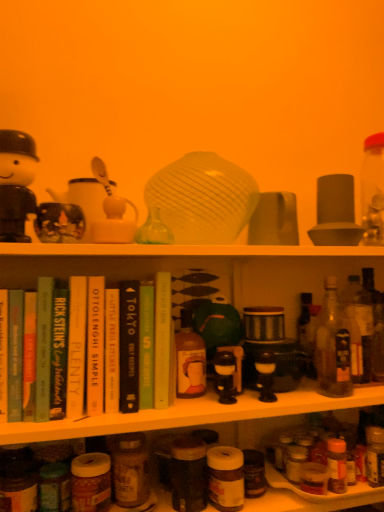
Question: Is matte brown bottle at lower center, marked as the first bottle in a left-to-right arrangement, not inside translucent glass bottle at right, which is counted as the third bottle, starting from the right?

Choices:
 (A) yes
 (B) no

Answer: (A)

Question: From a real-world perspective, is matte brown bottle at lower center, marked as the first bottle in a left-to-right arrangement, located higher than translucent glass bottle at right, which is counted as the third bottle, starting from the right?

Choices:
 (A) no
 (B) yes

Answer: (A)

Question: Does matte brown bottle at lower center, positioned as the 5th bottle in right-to-left order, have a larger size compared to translucent glass bottle at right, the third bottle in the left-to-right sequence?

Choices:
 (A) no
 (B) yes

Answer: (B)

Question: Considering the relative sizes of matte brown bottle at lower center, positioned as the 5th bottle in right-to-left order, and translucent glass bottle at right, the third bottle in the left-to-right sequence, in the image provided, is matte brown bottle at lower center, positioned as the 5th bottle in right-to-left order, taller than translucent glass bottle at right, the third bottle in the left-to-right sequence,?

Choices:
 (A) yes
 (B) no

Answer: (B)

Question: Considering the relative positions of matte brown bottle at lower center, positioned as the 5th bottle in right-to-left order, and translucent glass bottle at right, which is counted as the third bottle, starting from the right, in the image provided, is matte brown bottle at lower center, positioned as the 5th bottle in right-to-left order, behind translucent glass bottle at right, which is counted as the third bottle, starting from the right,?

Choices:
 (A) yes
 (B) no

Answer: (B)

Question: Considering the positions of green matte teapot at center, placed as the 4th toy when sorted from top to bottom, and matte black figurine at upper left, which appears as the 3th toy when viewed from the top, in the image, is green matte teapot at center, placed as the 4th toy when sorted from top to bottom, bigger or smaller than matte black figurine at upper left, which appears as the 3th toy when viewed from the top,?

Choices:
 (A) big
 (B) small

Answer: (A)

Question: From a real-world perspective, is green matte teapot at center, which ranks as the 4th toy in front-to-back order, above or below matte black figurine at upper left, acting as the third toy starting from the right?

Choices:
 (A) above
 (B) below

Answer: (B)

Question: In terms of height, does green matte teapot at center, which is the 1th toy in back-to-front order, look taller or shorter compared to matte black figurine at upper left, which appears as the 3th toy when viewed from the top?

Choices:
 (A) tall
 (B) short

Answer: (A)

Question: In the image, is green matte teapot at center, placed as the 4th toy when sorted from top to bottom, positioned in front of or behind matte black figurine at upper left, which is the 2th toy from front to back?

Choices:
 (A) front
 (B) behind

Answer: (B)

Question: Would you say matte black figurine at upper left, which ranks as the 4th toy in right-to-left order, is to the left or to the right of translucent glass bottle at right, which is counted as the 5th bottle, starting from the left, in the picture?

Choices:
 (A) left
 (B) right

Answer: (A)

Question: Is point (13, 138) closer or farther from the camera than point (364, 311)?

Choices:
 (A) closer
 (B) farther

Answer: (A)

Question: Is matte black figurine at upper left, the 4th toy when ordered from bottom to top, wider or thinner than translucent glass bottle at right, which is counted as the 5th bottle, starting from the left?

Choices:
 (A) wide
 (B) thin

Answer: (A)

Question: From their relative heights in the image, would you say matte black figurine at upper left, the 4th toy when ordered from bottom to top, is taller or shorter than translucent glass bottle at right, which is counted as the 5th bottle, starting from the left?

Choices:
 (A) tall
 (B) short

Answer: (A)

Question: Does point (225, 316) appear closer or farther from the camera than point (334, 381)?

Choices:
 (A) farther
 (B) closer

Answer: (B)

Question: Is green matte teapot at center, which ranks as the 4th toy in front-to-back order, taller or shorter than translucent glass bottle at right, which is counted as the third bottle, starting from the right?

Choices:
 (A) tall
 (B) short

Answer: (B)